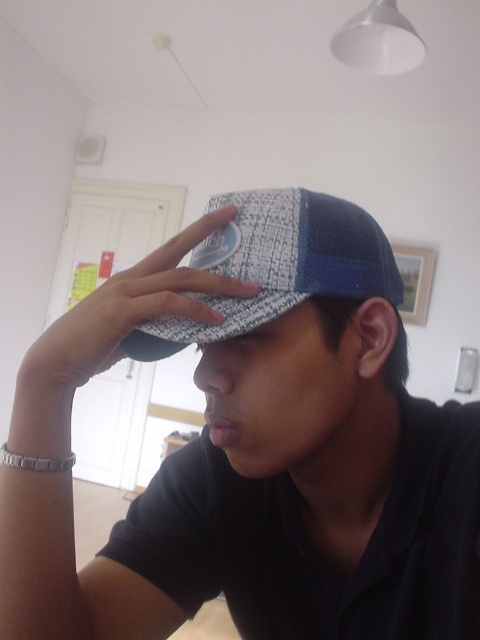
Question: Observing the image, what is the correct spatial positioning of woven fabric cap at center in reference to blue mesh cap at center?

Choices:
 (A) below
 (B) above

Answer: (A)

Question: Is blue mesh cap at center positioned in front of white textured cap at center?

Choices:
 (A) no
 (B) yes

Answer: (B)

Question: Which of the following is the farthest from the observer?

Choices:
 (A) blue mesh cap at center
 (B) woven fabric cap at center

Answer: (B)

Question: Considering the relative positions of blue mesh cap at center and white textured cap at center in the image provided, where is blue mesh cap at center located with respect to white textured cap at center?

Choices:
 (A) above
 (B) below

Answer: (A)

Question: Which object is the farthest from the blue mesh cap at center?

Choices:
 (A) white textured cap at center
 (B) woven fabric cap at center

Answer: (B)

Question: Which object is the farthest from the white textured cap at center?

Choices:
 (A) woven fabric cap at center
 (B) blue mesh cap at center

Answer: (A)